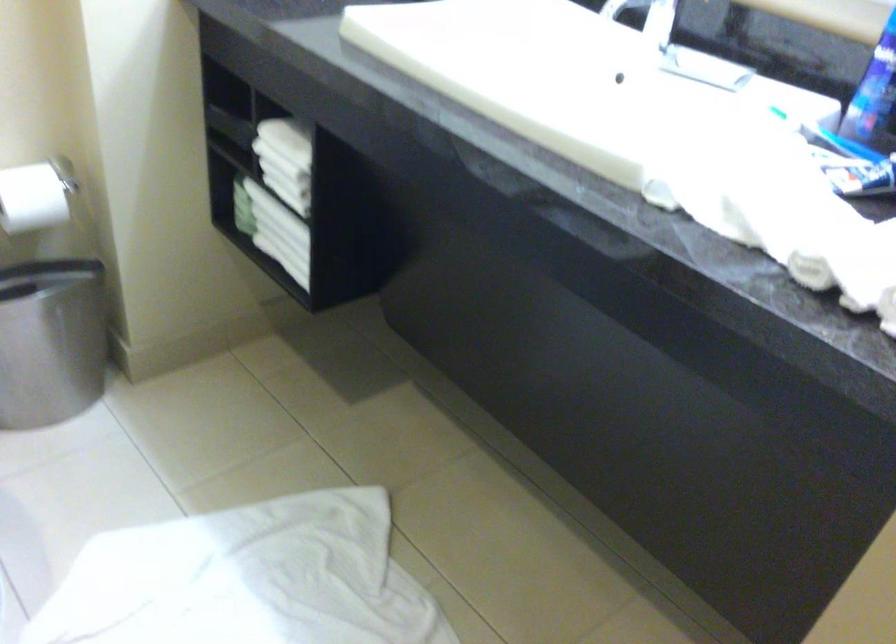
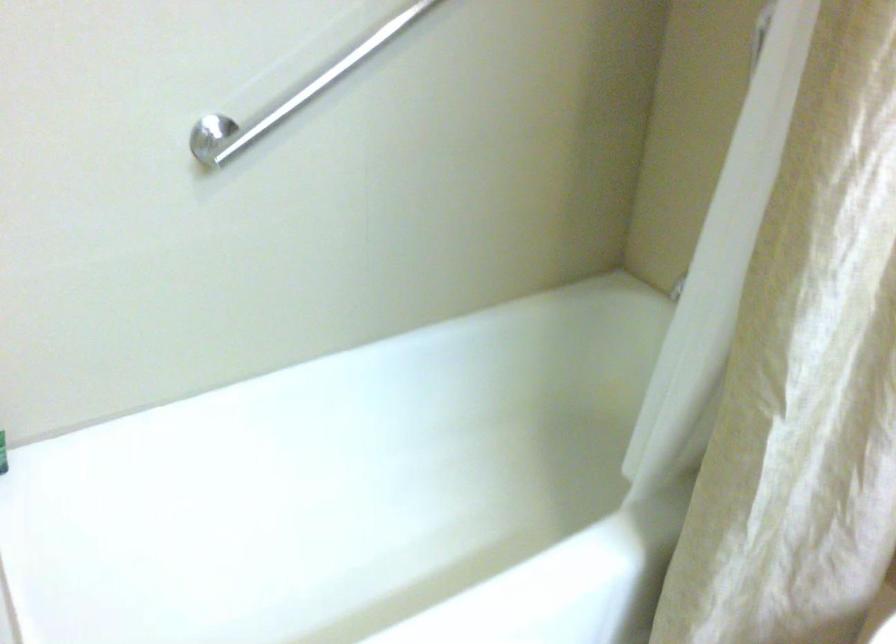
First-person continuous shooting, in which direction is the camera rotating?

The camera's rotation is toward left-down.